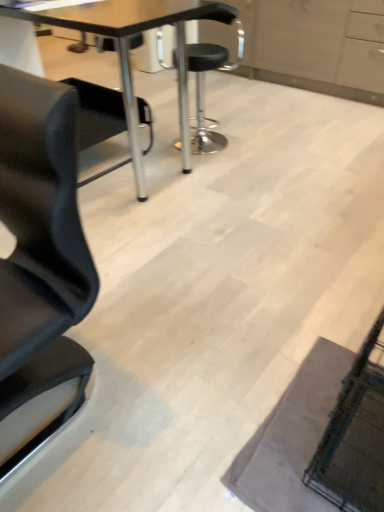
Question: Is the depth of matte black table at center less than that of black leather stool at center?

Choices:
 (A) yes
 (B) no

Answer: (A)

Question: Does matte black table at center have a lesser width compared to black leather stool at center?

Choices:
 (A) yes
 (B) no

Answer: (B)

Question: Does matte black table at center have a larger size compared to black leather stool at center?

Choices:
 (A) yes
 (B) no

Answer: (A)

Question: Does matte black table at center have a smaller size compared to black leather stool at center?

Choices:
 (A) no
 (B) yes

Answer: (A)

Question: Can you confirm if matte black table at center is taller than black leather stool at center?

Choices:
 (A) yes
 (B) no

Answer: (A)

Question: Is matte black table at center with black leather stool at center?

Choices:
 (A) no
 (B) yes

Answer: (A)

Question: Is black leather stool at center further to the viewer compared to matte black table at center?

Choices:
 (A) yes
 (B) no

Answer: (A)

Question: Does black leather stool at center have a greater width compared to matte black table at center?

Choices:
 (A) no
 (B) yes

Answer: (A)

Question: Does black leather stool at center lie in front of matte black table at center?

Choices:
 (A) no
 (B) yes

Answer: (A)

Question: Considering the relative sizes of black leather stool at center and matte black table at center in the image provided, is black leather stool at center shorter than matte black table at center?

Choices:
 (A) yes
 (B) no

Answer: (A)

Question: Does black leather stool at center have a greater height compared to matte black table at center?

Choices:
 (A) yes
 (B) no

Answer: (B)

Question: Is there a large distance between black leather stool at center and matte black table at center?

Choices:
 (A) yes
 (B) no

Answer: (B)

Question: From the image's perspective, relative to matte black table at center, is black leather stool at center above or below?

Choices:
 (A) above
 (B) below

Answer: (A)